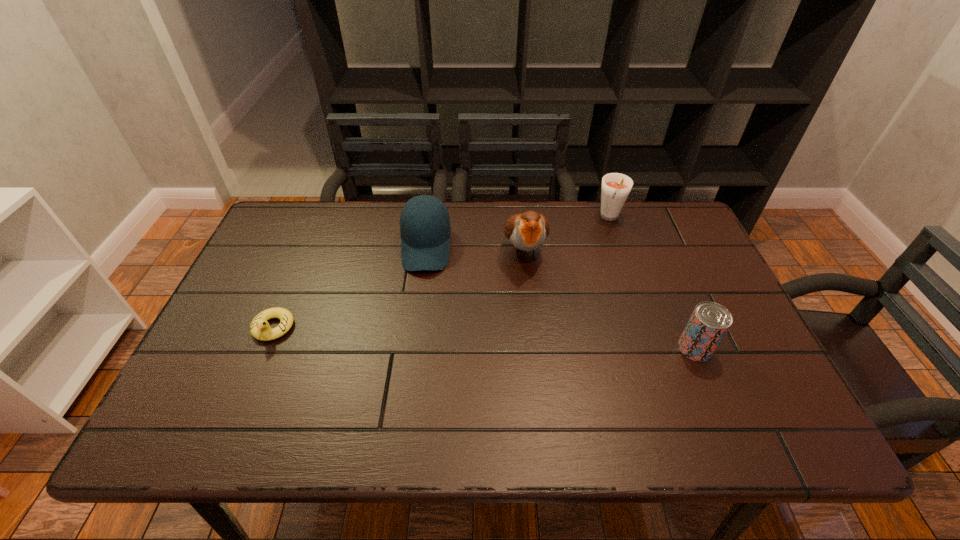
The width and height of the screenshot is (960, 540). I want to click on vacant area between the beer can and the third object from right to left, so click(x=610, y=300).

Where is `unoccupied position between the rightmost object and the second object from right to left`? The height and width of the screenshot is (540, 960). unoccupied position between the rightmost object and the second object from right to left is located at coordinates (653, 284).

Locate an element on the screen. empty space that is in between the third object from left to right and the duckling is located at coordinates (398, 290).

Locate an element on the screen. empty space that is in between the second object from left to right and the rightmost object is located at coordinates (561, 298).

Locate an element on the screen. free space between the root beer and the duckling is located at coordinates (442, 273).

Locate an element on the screen. This screenshot has height=540, width=960. object that is the nearest to the second object from right to left is located at coordinates (527, 231).

Select which object appears as the second closest to the baseball cap. Please provide its 2D coordinates. Your answer should be formatted as a tuple, i.e. [(x, y)], where the tuple contains the x and y coordinates of a point satisfying the conditions above.

[(260, 329)]

Where is `vacant space that satisfies the following two spatial constraints: 1. on the back side of the fourth object from right to left; 2. on the right side of the root beer`? The image size is (960, 540). vacant space that satisfies the following two spatial constraints: 1. on the back side of the fourth object from right to left; 2. on the right side of the root beer is located at coordinates (x=429, y=218).

Locate an element on the screen. vacant region that satisfies the following two spatial constraints: 1. on the face of the rightmost object; 2. on the left side of the duckling is located at coordinates (264, 348).